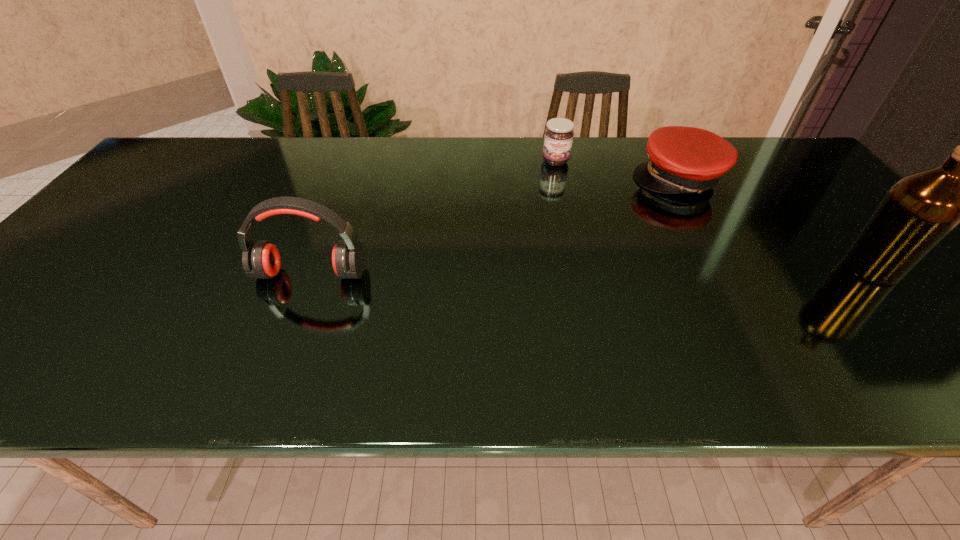
You are a GUI agent. You are given a task and a screenshot of the screen. Output one action in this format:
    pyautogui.click(x=<x>, y=<y>)
    Task: Click on the vacant space on the desktop that is between the leftmost object and the rightmost object and is positioned at the front of the cap where the visor is located
    The height and width of the screenshot is (540, 960).
    Given the screenshot: What is the action you would take?
    pyautogui.click(x=583, y=271)

Identify the location of vacant spot on the desktop that is between the earphone and the rightmost object and is positioned on the front label of the jam. The image size is (960, 540). (568, 271).